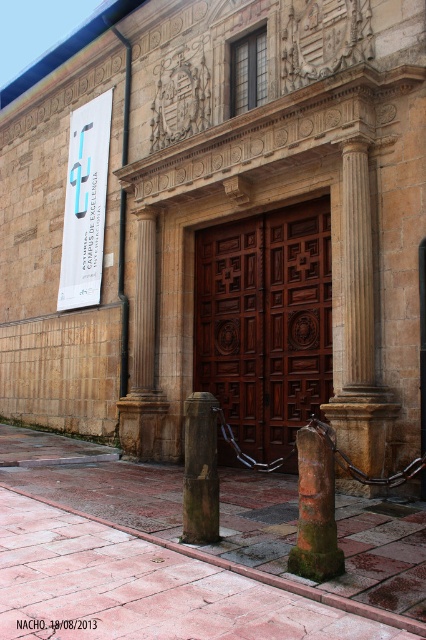
You are standing at the entrance of the historic building and see the wooden at center and the wooden post at center. Which object is located to the right of the other?

The wooden at center is positioned on the right side of wooden post at center.

You are a visitor at the Asturias Campus de Excelencia and want to enter the building. You see the wooden door at center and the wooden at center. Which one is bigger?

The wooden door at center is larger in size than the wooden at center.